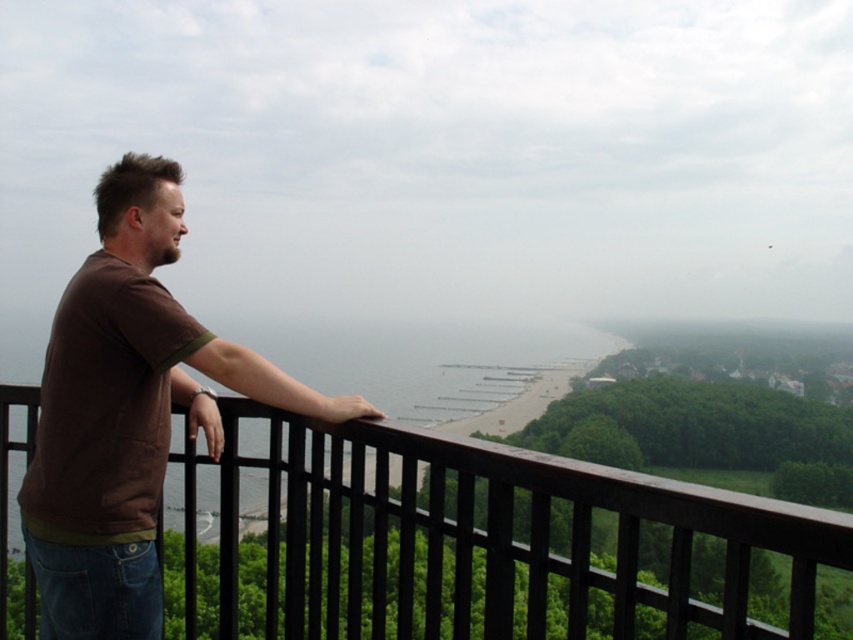
You are standing at the point labeled as point (492,538) in the image. What object are you touching?

The point (492,538) is on the brown wood rail at center, so you are touching the brown wood rail at center.